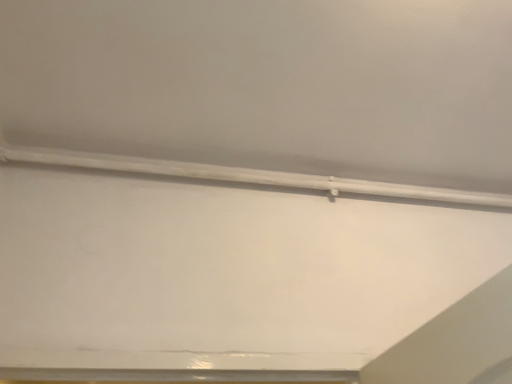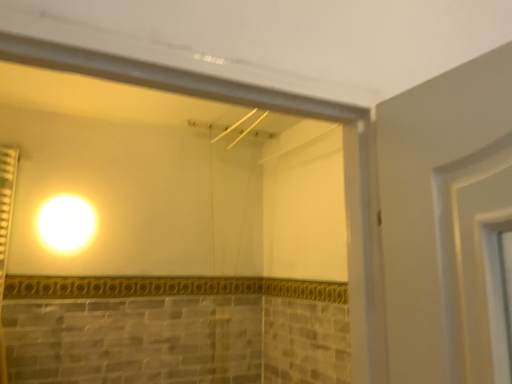
Question: Which way did the camera rotate in the video?

Choices:
 (A) rotated right
 (B) rotated left

Answer: (A)